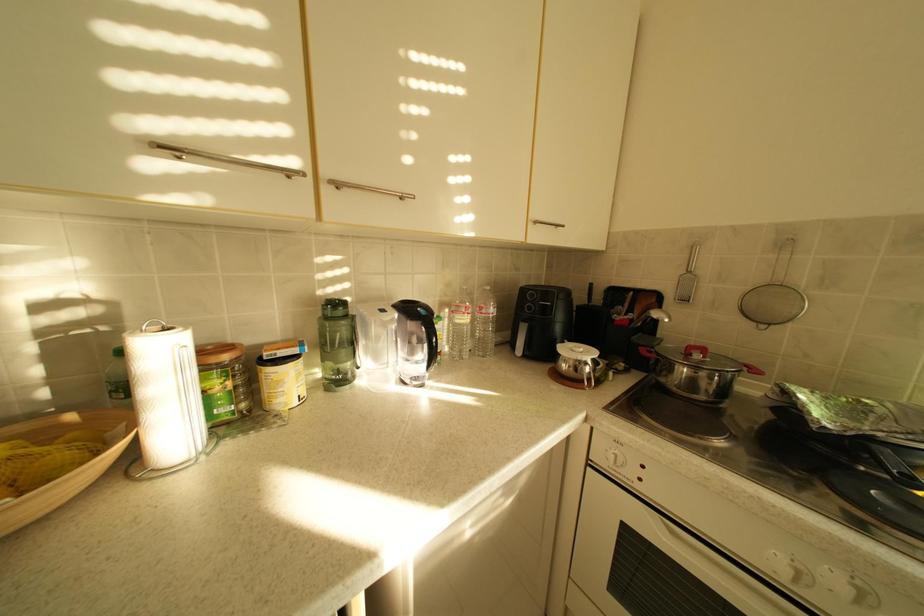
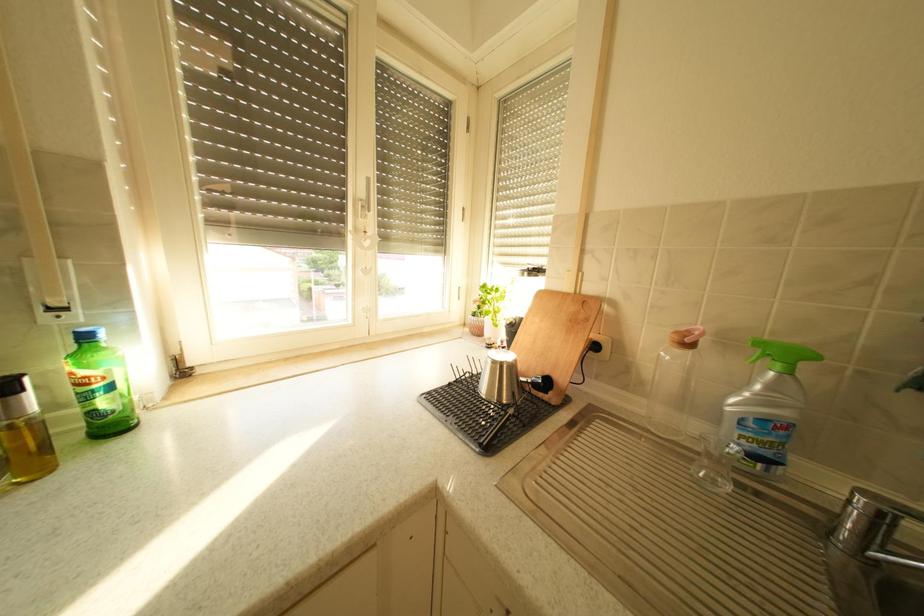
Question: How did the camera likely rotate?

Choices:
 (A) Left
 (B) Right
 (C) Up
 (D) Down

Answer: (B)